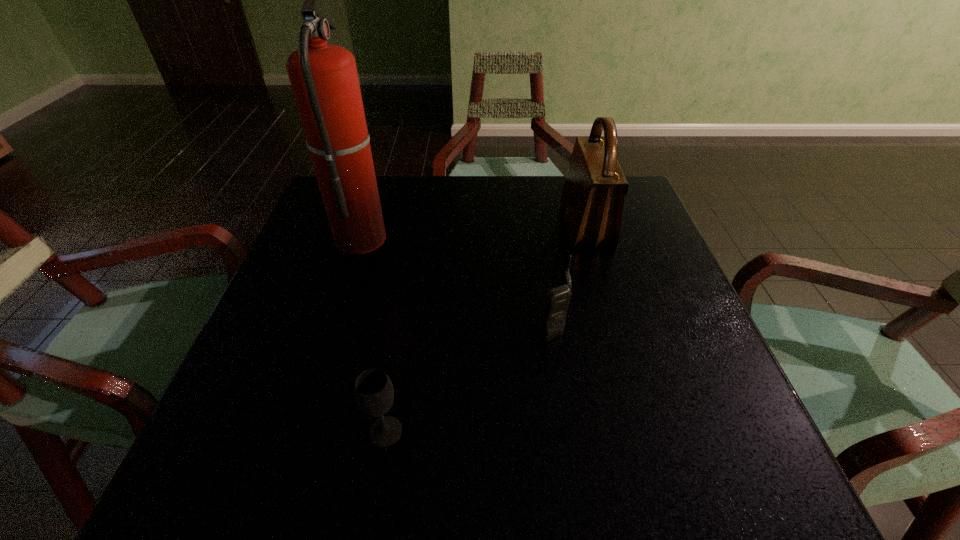
The width and height of the screenshot is (960, 540). I want to click on the tallest object, so click(x=324, y=79).

You are a GUI agent. You are given a task and a screenshot of the screen. Output one action in this format:
    pyautogui.click(x=<x>, y=<y>)
    Task: Click on the leftmost object
    
    Given the screenshot: What is the action you would take?
    pyautogui.click(x=324, y=79)

Locate an element on the screen. The height and width of the screenshot is (540, 960). the second tallest object is located at coordinates pyautogui.click(x=592, y=200).

Find the location of a particular element. This screenshot has height=540, width=960. shoulder bag is located at coordinates (592, 200).

Identify the location of cellular telephone. (557, 300).

The image size is (960, 540). Find the location of `the third object from left to right`. the third object from left to right is located at coordinates (557, 300).

Identify the location of the second object from left to right. (373, 390).

You are a GUI agent. You are given a task and a screenshot of the screen. Output one action in this format:
    pyautogui.click(x=<x>, y=<y>)
    Task: Click on the wineglass
    
    Given the screenshot: What is the action you would take?
    pyautogui.click(x=373, y=390)

At what (x,y) coordinates should I click in order to perform the action: click on free location located 0.370m with the nozzle and gauge on the tallest object. Please return your answer as a coordinate pair (x, y). This screenshot has height=540, width=960. Looking at the image, I should click on (541, 237).

What are the coordinates of `free spot located on the front flap of the shoulder bag` in the screenshot? It's located at (535, 226).